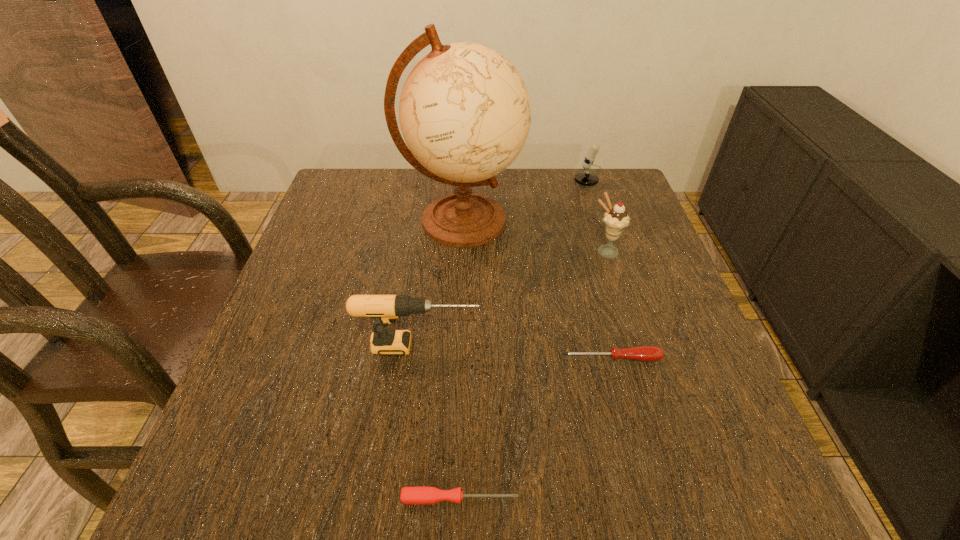
Find the location of `free spot located on the handle side of the drill`. free spot located on the handle side of the drill is located at coordinates (561, 346).

Where is `vacant region located 0.180m on the left of the microphone`? vacant region located 0.180m on the left of the microphone is located at coordinates (511, 185).

This screenshot has width=960, height=540. I want to click on vacant space located 0.160m on the back of the taller screwdriver, so click(x=594, y=292).

The image size is (960, 540). In order to click on vacant space situated 0.310m at the tip of the nearest object in this screenshot , I will do `click(726, 498)`.

I want to click on globe that is at the far edge, so click(x=465, y=113).

This screenshot has height=540, width=960. I want to click on microphone positioned at the far edge, so click(586, 178).

At what (x,y) coordinates should I click in order to perform the action: click on object at the near edge. Please return your answer as a coordinate pair (x, y). Looking at the image, I should click on (415, 495).

Identify the location of icecream that is at the right edge. (616, 219).

The height and width of the screenshot is (540, 960). Find the location of `microphone positioned at the right edge`. microphone positioned at the right edge is located at coordinates (586, 178).

Image resolution: width=960 pixels, height=540 pixels. Identify the location of screwdriver located in the right edge section of the desktop. (641, 353).